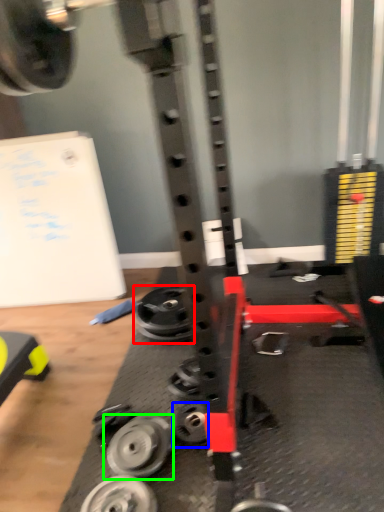
Question: Which object is positioned closest to wheel (highlighted by a red box)? Select from wheel (highlighted by a blue box) and wheel (highlighted by a green box).

Choices:
 (A) wheel
 (B) wheel

Answer: (A)